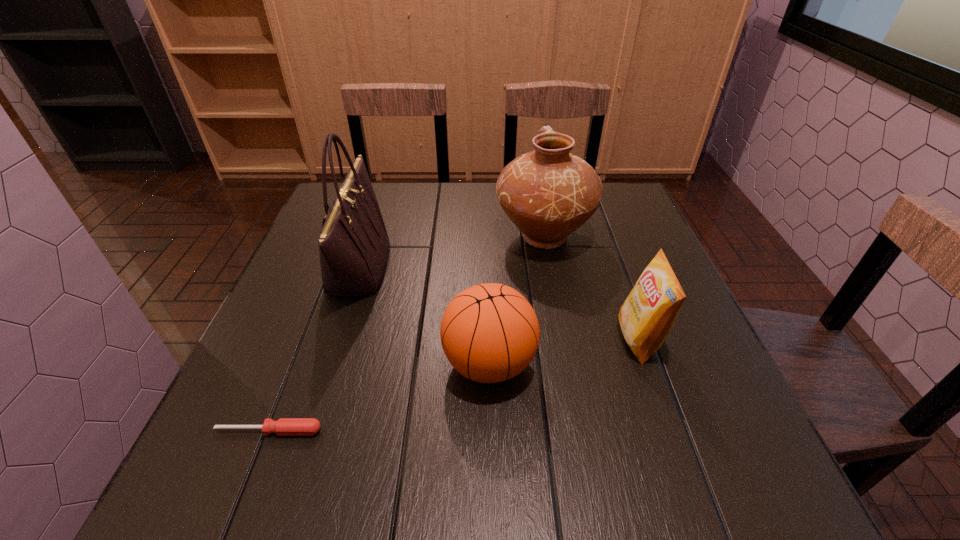
This screenshot has height=540, width=960. What are the coordinates of `the tallest object` in the screenshot? It's located at (353, 244).

The width and height of the screenshot is (960, 540). Find the location of `pottery`. pottery is located at coordinates (548, 193).

Locate an element on the screen. crisp (potato chip) is located at coordinates (647, 315).

I want to click on basketball, so click(490, 333).

I want to click on the shortest object, so click(284, 426).

Identify the location of screwdriver. This screenshot has height=540, width=960. (284, 426).

At what (x,y) coordinates should I click in order to perform the action: click on vacant area situated 0.060m on the front-facing side of the handbag. Please return your answer as a coordinate pair (x, y). Image resolution: width=960 pixels, height=540 pixels. Looking at the image, I should click on 412,267.

At what (x,y) coordinates should I click in order to perform the action: click on vacant area located 0.150m on the side of the pottery with the handle. Please return your answer as a coordinate pair (x, y). The height and width of the screenshot is (540, 960). Looking at the image, I should click on (534, 184).

Locate an element on the screen. This screenshot has height=540, width=960. free location located 0.050m on the side of the pottery with the handle is located at coordinates (537, 201).

You are a GUI agent. You are given a task and a screenshot of the screen. Output one action in this format:
    pyautogui.click(x=<x>, y=<y>)
    Task: Click on the vacant space located 0.060m on the side of the pottery with the handle
    
    Given the screenshot: What is the action you would take?
    pyautogui.click(x=537, y=199)